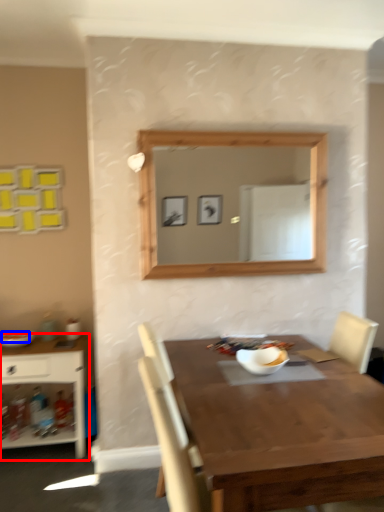
Question: Among these objects, which one is farthest to the camera, shelf (highlighted by a red box) or food (highlighted by a blue box)?

Choices:
 (A) shelf
 (B) food

Answer: (B)